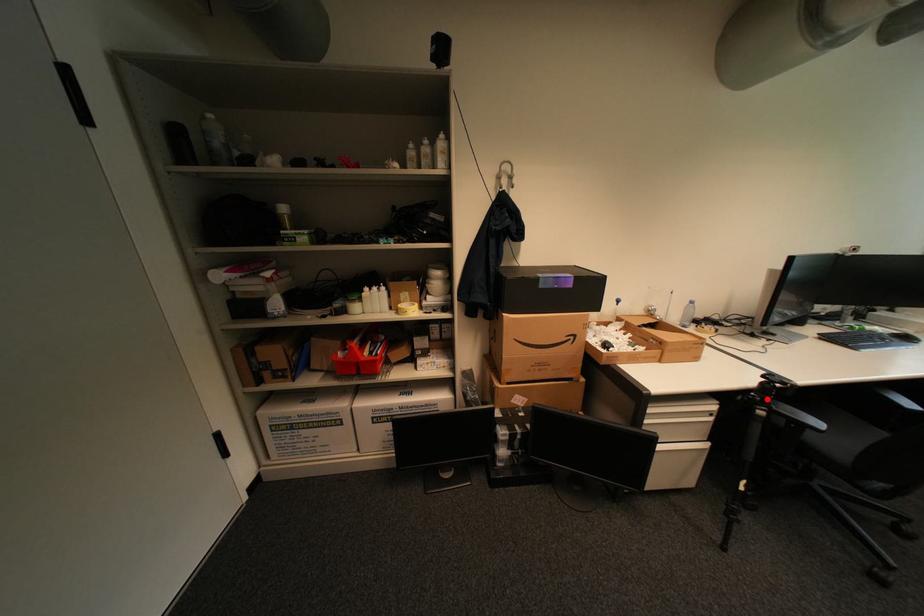
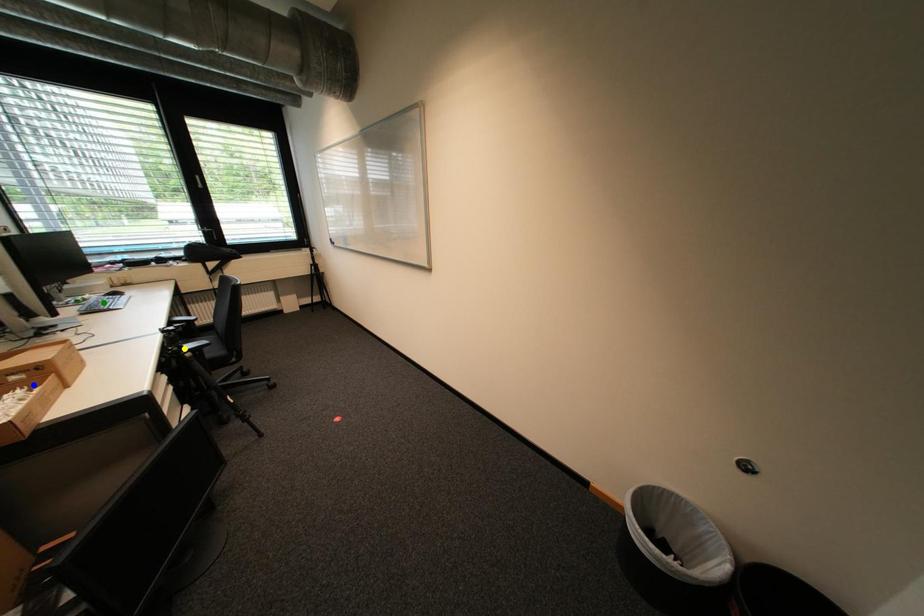
Question: I am providing you with two images of the same scene from different viewpoints. A red point is marked on the first image. You are given multiple points on the second image. Can you choose the point in image 2 that corresponds to the point in image 1?

Choices:
 (A) blue point
 (B) green point
 (C) yellow point

Answer: (C)